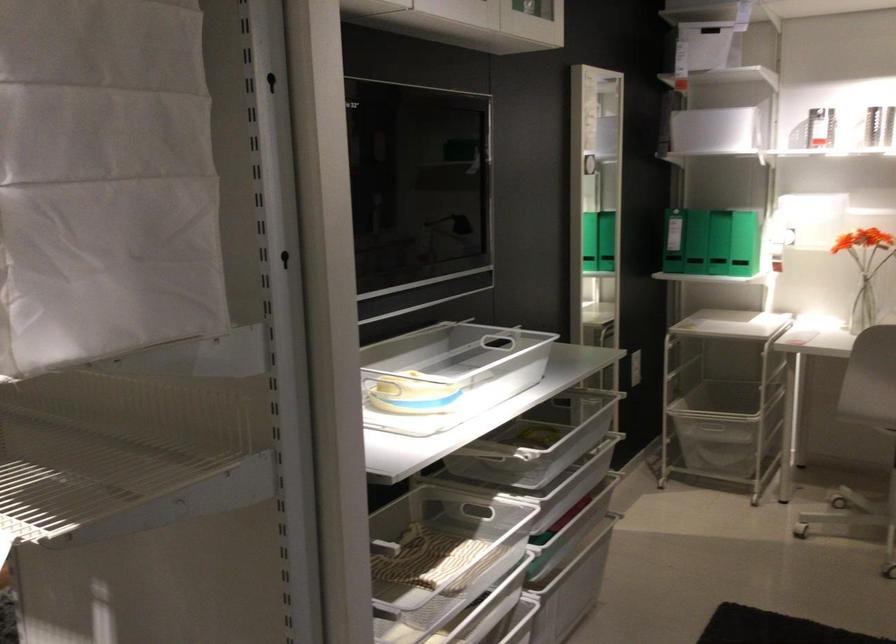
Locate an element on the screen. The width and height of the screenshot is (896, 644). chair sitting surface is located at coordinates (869, 379).